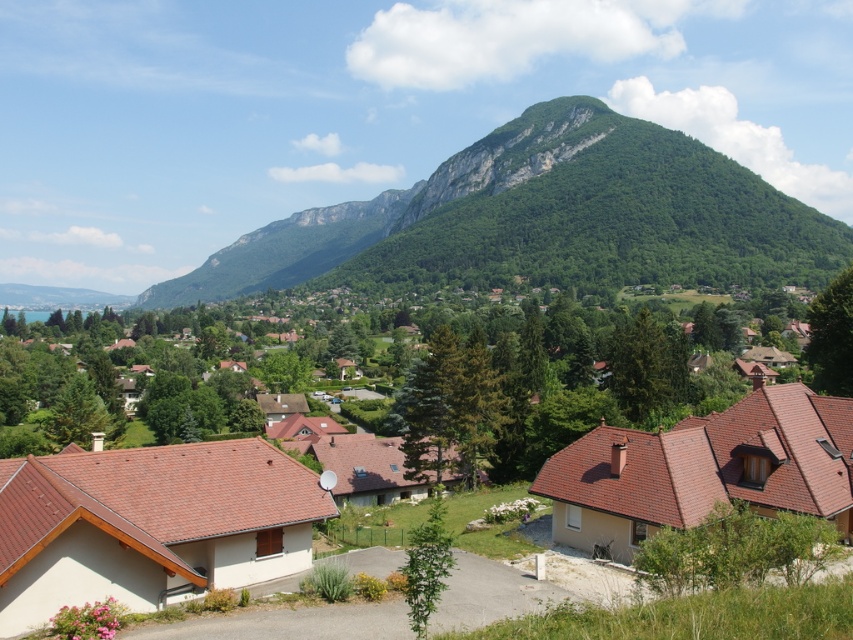
You are standing in the residential area with the houses and want to take a photo of the green forested mountain at upper center. Where should you position your camera to ensure the mountain is centered in the frame?

To center the green forested mountain at upper center in your photo, position your camera at point 0.342 on the x and 0.638 on the y coordinates, as this matches the mountain location.

You are an architect designing a new housing development and want to ensure the houses will not block the view of the green forested mountain at upper center from the brown tiled houses at center. Based on the scene, can you confirm if the mountain is large enough to remain visible above the houses?

The green forested mountain at upper center has a larger size compared to brown tiled houses at center, so it will remain visible above the houses.